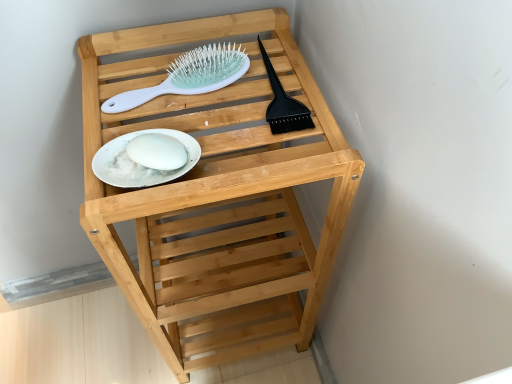
Where is `unoccupied region to the right of white plastic hairbrush at upper center`? The height and width of the screenshot is (384, 512). unoccupied region to the right of white plastic hairbrush at upper center is located at coordinates (265, 87).